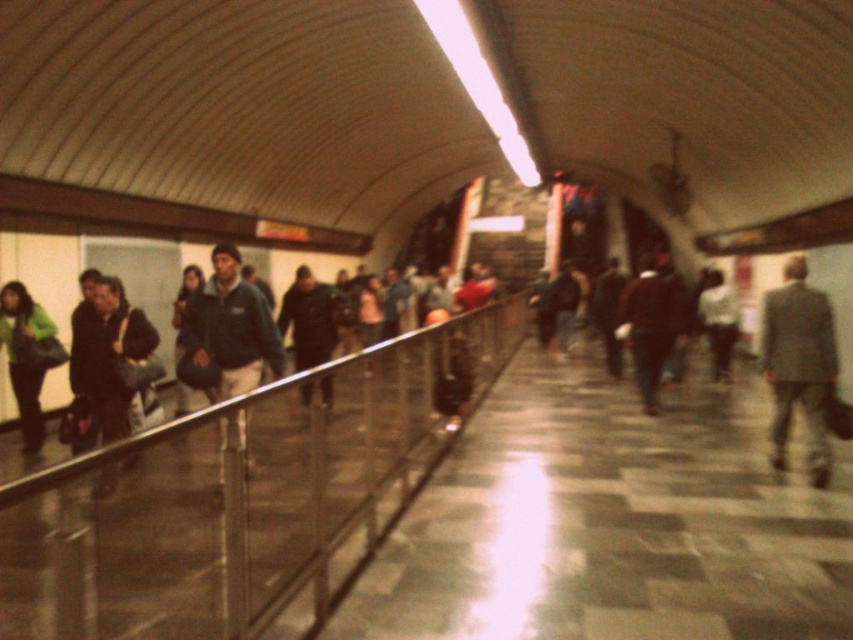
You are standing on the platform in the subway station and want to reach the metallic silver rail at left. Which direction should you move to get there?

You should move to your left since the metallic silver rail at left is located on the left side of the platform.

You are standing at the entrance of the subway station and see two points marked in the scene. Which point, point (68, 516) or point (810, 454), is nearer to you?

Point (68, 516) is closer to the viewer than point (810, 454).

You are standing on the subway platform and notice the metallic silver rail at left and the green fabric jacket at left. Which object appears narrower from your perspective?

The metallic silver rail at left appears narrower than the green fabric jacket at left because it has a lesser width compared to it.